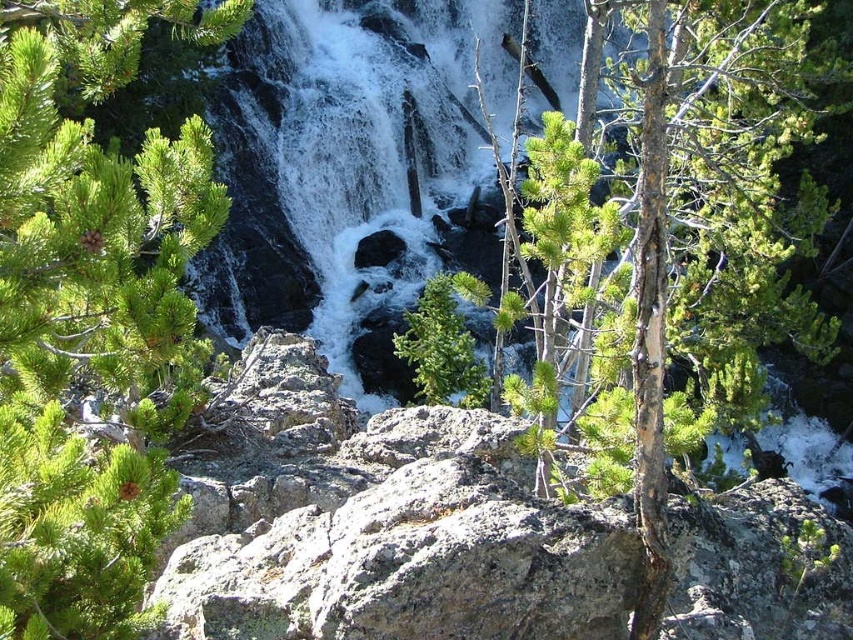
Is green needle-like at left to the right of white frothy water at center from the viewer's perspective?

Incorrect, green needle-like at left is not on the right side of white frothy water at center.

Measure the distance between point (30, 272) and camera.

A distance of 7.62 feet exists between point (30, 272) and camera.

Is point (21, 237) more distant than point (303, 224)?

No.

You are a GUI agent. You are given a task and a screenshot of the screen. Output one action in this format:
    pyautogui.click(x=<x>, y=<y>)
    Task: Click on the green needle-like at left
    This screenshot has width=853, height=640.
    Given the screenshot: What is the action you would take?
    pyautogui.click(x=93, y=314)

Is green rough bark tree at center shorter than white frothy water at center?

Yes.

You are a GUI agent. You are given a task and a screenshot of the screen. Output one action in this format:
    pyautogui.click(x=<x>, y=<y>)
    Task: Click on the green rough bark tree at center
    The height and width of the screenshot is (640, 853).
    Given the screenshot: What is the action you would take?
    pyautogui.click(x=675, y=234)

Which is in front, point (723, 241) or point (497, 106)?

Positioned in front is point (723, 241).

Locate an element on the screen. This screenshot has height=640, width=853. green rough bark tree at center is located at coordinates (675, 234).

Between green needle-like at left and green rough bark tree at center, which one is positioned lower?

green needle-like at left

Looking at this image, is green needle-like at left to the right of green rough bark tree at center from the viewer's perspective?

Incorrect, green needle-like at left is not on the right side of green rough bark tree at center.

Measure the distance between point (7, 17) and camera.

3.25 meters

Where is `green needle-like at left`? The width and height of the screenshot is (853, 640). green needle-like at left is located at coordinates (93, 314).